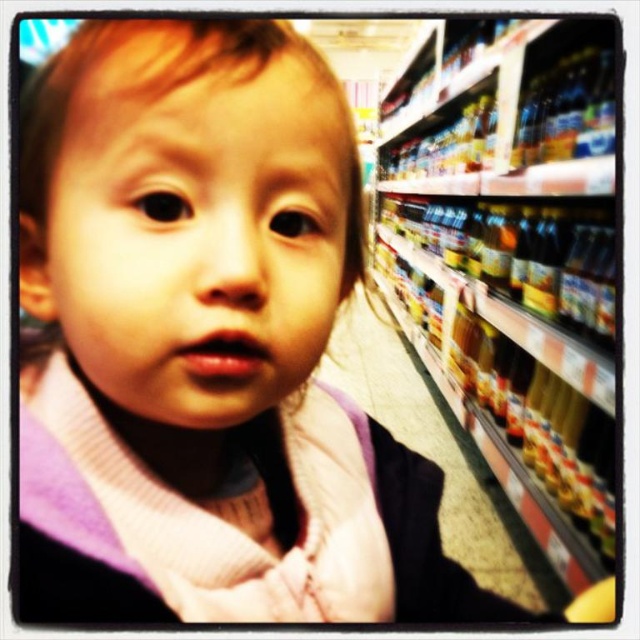
In the grocery store aisle, there are metallic glass bottles at right and translucent plastic bottles at right. Which type of bottles are positioned higher on the shelf?

The metallic glass bottles at right are positioned higher on the shelf than the translucent plastic bottles at right.

You are a delivery person who needs to place a package that is 30 inches long on the metallic glass bottles at right. Can the package fit on the bottles without overhanging?

The metallic glass bottles at right are 29.68 inches from viewer, so the package that is 30 inches long will overhang by approximately 0.32 inches.